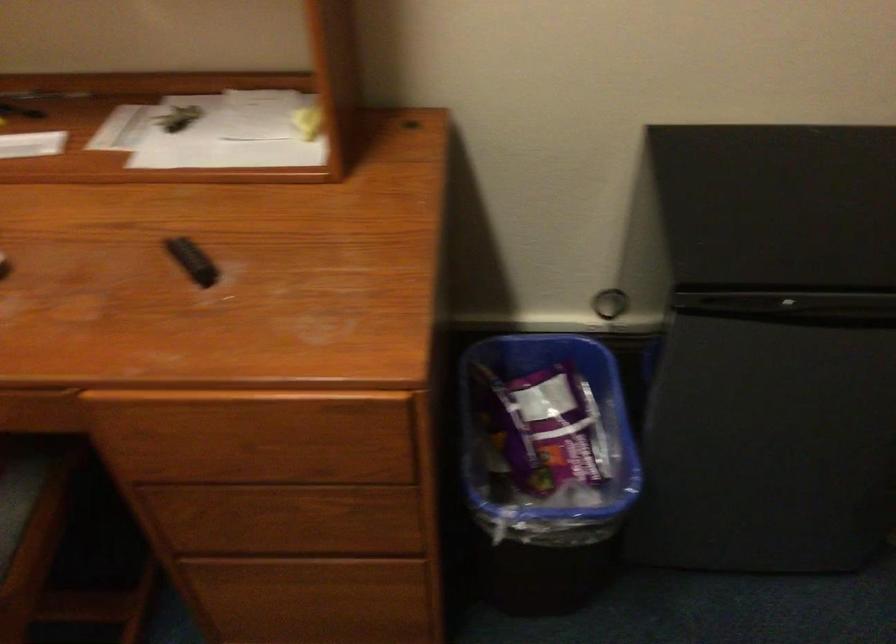
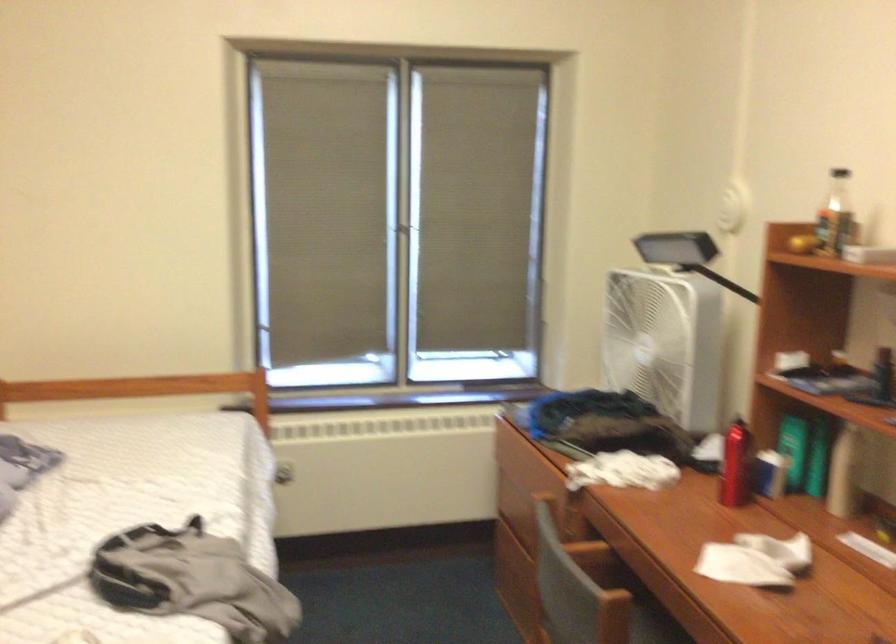
Question: The camera is either moving clockwise (left) or counter-clockwise (right) around the object. The first image is from the beginning of the video and the second image is from the end. Is the camera moving left or right when shooting the video?

Choices:
 (A) Left
 (B) Right

Answer: (B)